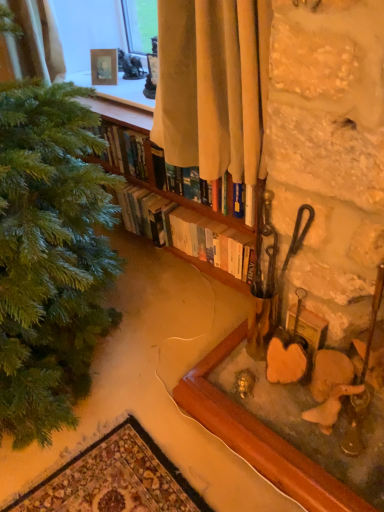
Question: Does beige fabric curtain at upper center come in front of hardcover books at center?

Choices:
 (A) yes
 (B) no

Answer: (A)

Question: From a real-world perspective, is beige fabric curtain at upper center physically above hardcover books at center?

Choices:
 (A) yes
 (B) no

Answer: (A)

Question: Considering the relative sizes of beige fabric curtain at upper center and hardcover books at center in the image provided, is beige fabric curtain at upper center wider than hardcover books at center?

Choices:
 (A) yes
 (B) no

Answer: (A)

Question: Can you confirm if beige fabric curtain at upper center is bigger than hardcover books at center?

Choices:
 (A) no
 (B) yes

Answer: (B)

Question: Is beige fabric curtain at upper center facing away from hardcover books at center?

Choices:
 (A) no
 (B) yes

Answer: (A)

Question: Is wooden picture frame at lower right, which is the 2th picture frame in top-to-bottom order, inside or outside of hardcover books at center?

Choices:
 (A) outside
 (B) inside

Answer: (A)

Question: Visually, is wooden picture frame at lower right, which appears as the first picture frame when viewed from the right, positioned to the left or to the right of hardcover books at center?

Choices:
 (A) left
 (B) right

Answer: (B)

Question: From the image's perspective, is wooden picture frame at lower right, which appears as the first picture frame when viewed from the right, located above or below hardcover books at center?

Choices:
 (A) below
 (B) above

Answer: (A)

Question: Is wooden picture frame at lower right, acting as the 1th picture frame starting from the bottom, wider or thinner than hardcover books at center?

Choices:
 (A) thin
 (B) wide

Answer: (A)

Question: From a real-world perspective, relative to wooden frame at upper center, the first picture frame positioned from the back, is hardcover books at center vertically above or below?

Choices:
 (A) below
 (B) above

Answer: (A)

Question: Does point (124, 169) appear closer or farther from the camera than point (114, 75)?

Choices:
 (A) closer
 (B) farther

Answer: (A)

Question: Considering the positions of hardcover books at center and wooden frame at upper center, the second picture frame in the right-to-left sequence, in the image, is hardcover books at center wider or thinner than wooden frame at upper center, the second picture frame in the right-to-left sequence,?

Choices:
 (A) thin
 (B) wide

Answer: (B)

Question: Relative to wooden frame at upper center, the second picture frame in the right-to-left sequence, is hardcover books at center in front or behind?

Choices:
 (A) front
 (B) behind

Answer: (A)

Question: From a real-world perspective, is beige fabric curtain at upper center positioned above or below wooden frame at upper center, the second picture frame in the right-to-left sequence?

Choices:
 (A) below
 (B) above

Answer: (B)

Question: From their relative heights in the image, would you say beige fabric curtain at upper center is taller or shorter than wooden frame at upper center, the first picture frame from the top?

Choices:
 (A) tall
 (B) short

Answer: (A)